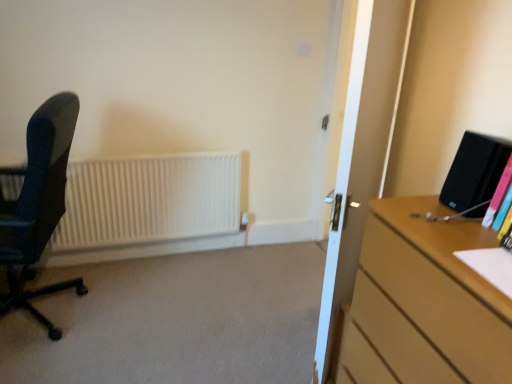
Image resolution: width=512 pixels, height=384 pixels. What do you see at coordinates (149, 206) in the screenshot? I see `white matte radiator at left` at bounding box center [149, 206].

What do you see at coordinates (424, 303) in the screenshot? The width and height of the screenshot is (512, 384). I see `wooden desk at right` at bounding box center [424, 303].

This screenshot has height=384, width=512. Find the location of `wooden desk at right`. wooden desk at right is located at coordinates click(424, 303).

I want to click on matte black office chair at left, so [39, 204].

Is transparent glass door at center to the left or to the right of multicolored plastic book at right in the image?

Clearly, transparent glass door at center is on the left of multicolored plastic book at right in the image.

Is transparent glass door at center situated inside multicolored plastic book at right or outside?

transparent glass door at center is outside multicolored plastic book at right.

Which object is thinner, transparent glass door at center or multicolored plastic book at right?

multicolored plastic book at right.

Looking at this image, is white matte radiator at left positioned with its back to multicolored plastic book at right?

No, white matte radiator at left is not facing the opposite direction of multicolored plastic book at right.

Would you say white matte radiator at left is to the left or to the right of multicolored plastic book at right in the picture?

Clearly, white matte radiator at left is on the left of multicolored plastic book at right in the image.

From the picture: Is white matte radiator at left not near multicolored plastic book at right?

white matte radiator at left is positioned a significant distance from multicolored plastic book at right.

From a real-world perspective, is white matte radiator at left on top of multicolored plastic book at right?

No.

Is point (49, 169) positioned behind point (441, 255)?

Yes, it is behind point (441, 255).

Based on the photo, does matte black office chair at left have a greater height compared to wooden desk at right?

Correct, matte black office chair at left is much taller as wooden desk at right.

How many degrees apart are the facing directions of matte black office chair at left and wooden desk at right?

The angular difference between matte black office chair at left and wooden desk at right is 6.4 degrees.

Can you confirm if matte black office chair at left is positioned to the left of wooden desk at right?

Indeed, matte black office chair at left is positioned on the left side of wooden desk at right.

What's the angular difference between matte black office chair at left and transparent glass door at center's facing directions?

The angle between the facing direction of matte black office chair at left and the facing direction of transparent glass door at center is 37.9 degrees.

Is matte black office chair at left taller than transparent glass door at center?

No.

Which object is thinner, matte black office chair at left or transparent glass door at center?

With smaller width is transparent glass door at center.

From the image's perspective, is transparent glass door at center under white matte radiator at left?

No.

Considering the sizes of objects transparent glass door at center and white matte radiator at left in the image provided, who is thinner, transparent glass door at center or white matte radiator at left?

With smaller width is white matte radiator at left.

Does transparent glass door at center contain white matte radiator at left?

No, white matte radiator at left is not inside transparent glass door at center.

From a real-world perspective, is transparent glass door at center beneath white matte radiator at left?

No, from a real-world perspective, transparent glass door at center is not below white matte radiator at left.

Is point (17, 280) positioned behind point (74, 212)?

No, (17, 280) is closer to viewer.

Are matte black office chair at left and white matte radiator at left far apart?

No, matte black office chair at left is not far from white matte radiator at left.

Does matte black office chair at left have a smaller size compared to white matte radiator at left?

No, matte black office chair at left is not smaller than white matte radiator at left.

Considering the sizes of objects matte black office chair at left and white matte radiator at left in the image provided, who is taller, matte black office chair at left or white matte radiator at left?

Standing taller between the two is matte black office chair at left.

Can matte black office chair at left be found inside multicolored plastic book at right?

No, multicolored plastic book at right does not contain matte black office chair at left.

From the image's perspective, between multicolored plastic book at right and matte black office chair at left, which one is located above?

multicolored plastic book at right, from the image's perspective.

Is multicolored plastic book at right far away from matte black office chair at left?

multicolored plastic book at right is far away from matte black office chair at left.

From a real-world perspective, between multicolored plastic book at right and matte black office chair at left, who is vertically lower?

matte black office chair at left is physically lower.

This screenshot has height=384, width=512. In the image, there is a transparent glass door at center. What are the coordinates of `book above it (from the image's perspective)` in the screenshot? It's located at (498, 196).

This screenshot has height=384, width=512. What are the coordinates of `book in front of the white matte radiator at left` in the screenshot? It's located at (498, 196).

Based on the photo, based on their spatial positions, is white matte radiator at left or matte black office chair at left further from wooden desk at right?

white matte radiator at left is further to wooden desk at right.

Estimate the real-world distances between objects in this image. Which object is further from multicolored plastic book at right, wooden desk at right or transparent glass door at center?

transparent glass door at center is positioned further to the anchor multicolored plastic book at right.

Looking at the image, which one is located closer to wooden desk at right, matte black office chair at left or transparent glass door at center?

Based on the image, transparent glass door at center appears to be nearer to wooden desk at right.

Considering their positions, is multicolored plastic book at right positioned closer to white matte radiator at left than transparent glass door at center?

Among the two, transparent glass door at center is located nearer to white matte radiator at left.

Looking at the image, which one is located further to wooden desk at right, transparent glass door at center or white matte radiator at left?

Among the two, white matte radiator at left is located further to wooden desk at right.

Estimate the real-world distances between objects in this image. Which object is closer to wooden desk at right, transparent glass door at center or matte black office chair at left?

Among the two, transparent glass door at center is located nearer to wooden desk at right.

Considering their positions, is multicolored plastic book at right positioned further to white matte radiator at left than matte black office chair at left?

multicolored plastic book at right is positioned further to the anchor white matte radiator at left.

From the image, which object appears to be farther from transparent glass door at center, matte black office chair at left or multicolored plastic book at right?

The object further to transparent glass door at center is matte black office chair at left.

Where is `glass door situated between white matte radiator at left and wooden desk at right from left to right`? glass door situated between white matte radiator at left and wooden desk at right from left to right is located at coordinates (361, 152).

Where is `radiator situated between matte black office chair at left and transparent glass door at center from left to right`? The image size is (512, 384). radiator situated between matte black office chair at left and transparent glass door at center from left to right is located at coordinates (149, 206).

Where is `radiator between matte black office chair at left and wooden desk at right in the horizontal direction`? radiator between matte black office chair at left and wooden desk at right in the horizontal direction is located at coordinates (149, 206).

At what (x,y) coordinates should I click in order to perform the action: click on desk between white matte radiator at left and multicolored plastic book at right. Please return your answer as a coordinate pair (x, y). Looking at the image, I should click on (424, 303).